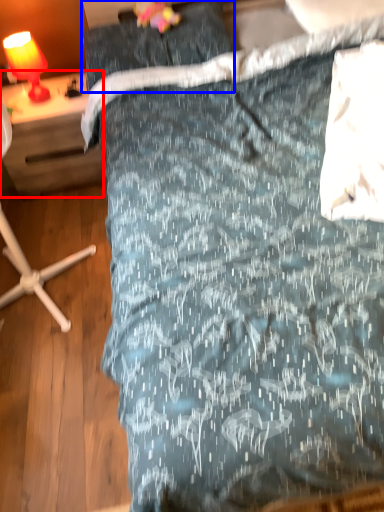
Question: Which object appears closest to the camera in this image, desk (highlighted by a red box) or pillow (highlighted by a blue box)?

Choices:
 (A) desk
 (B) pillow

Answer: (B)